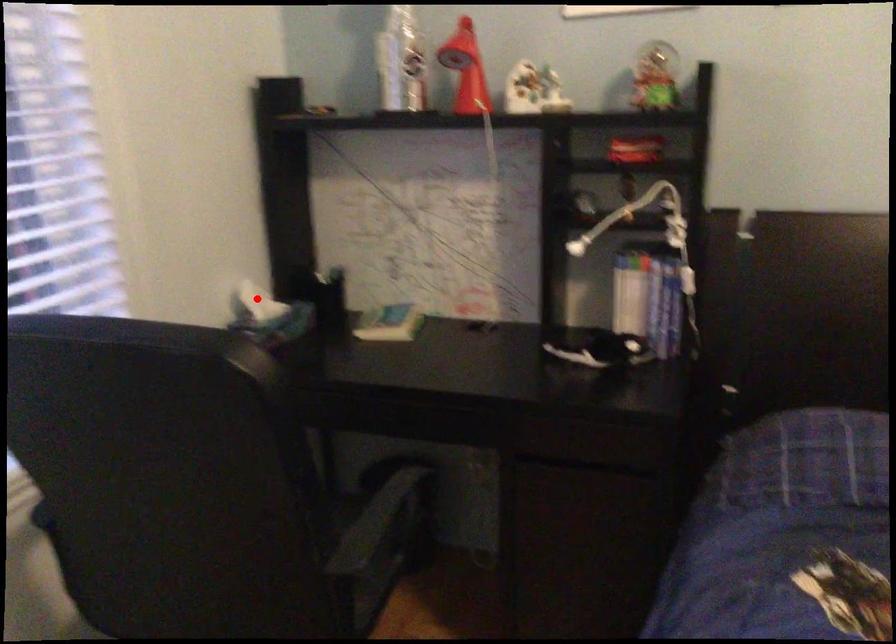
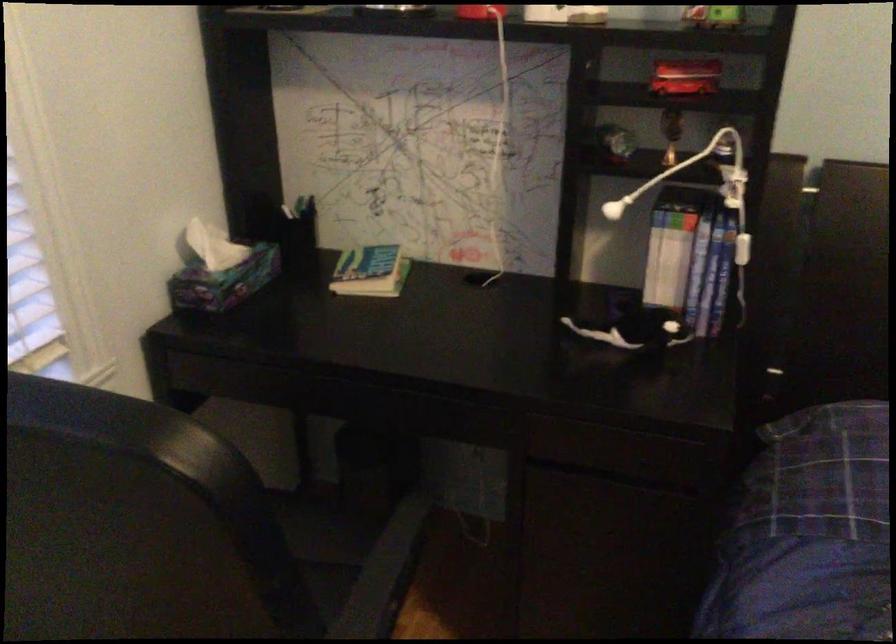
Where in the second image is the point corresponding to the highlighted location from the first image?

(213, 245)